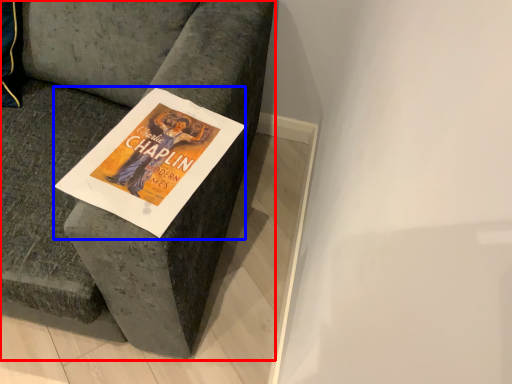
Question: Which point is further to the camera, furniture (highlighted by a red box) or magazine (highlighted by a blue box)?

Choices:
 (A) furniture
 (B) magazine

Answer: (B)